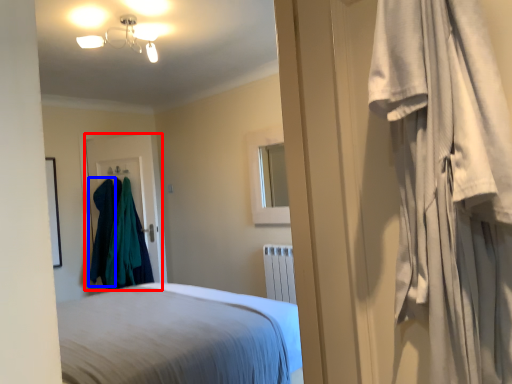
Question: Which point is closer to the camera, door (highlighted by a red box) or clothing (highlighted by a blue box)?

Choices:
 (A) door
 (B) clothing

Answer: (B)